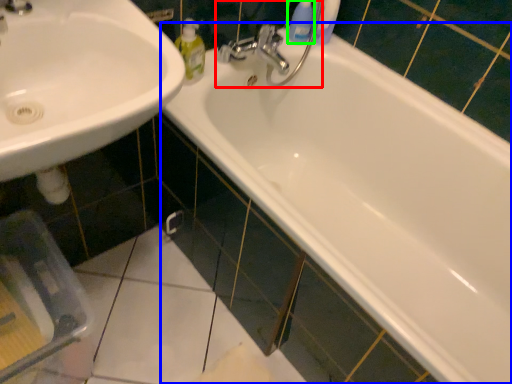
Question: Considering the real-world distances, which object is farthest from plumbing fixture (highlighted by a red box)? bathtub (highlighted by a blue box) or cleaning product (highlighted by a green box)?

Choices:
 (A) bathtub
 (B) cleaning product

Answer: (A)